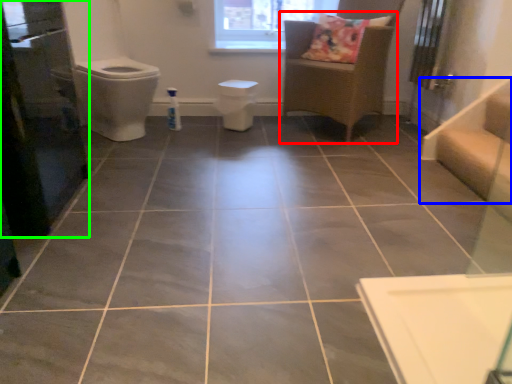
Question: Which is nearer to the furniture (highlighted by a red box)? stairwell (highlighted by a blue box) or screen door (highlighted by a green box).

Choices:
 (A) stairwell
 (B) screen door

Answer: (A)